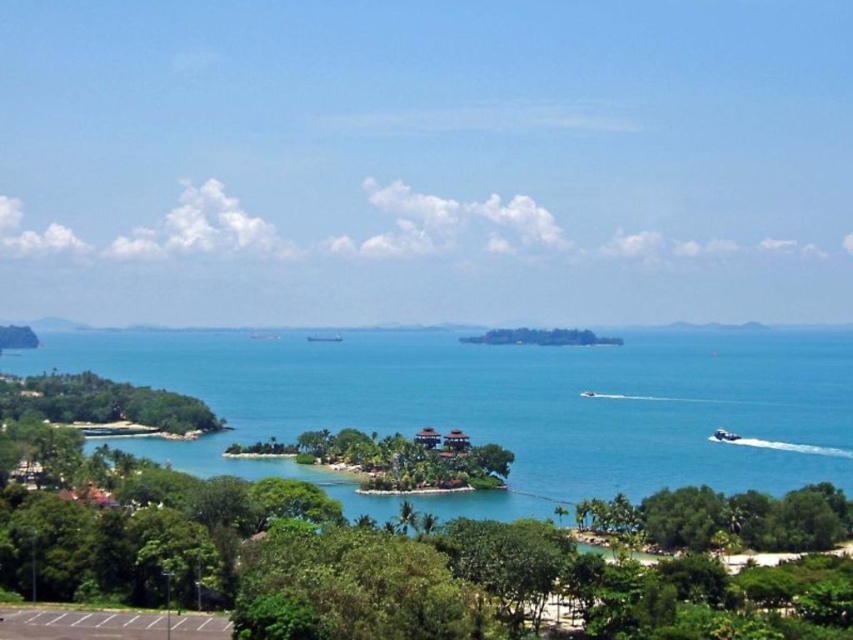
You are standing at the parking area and want to reach the island in the middle. There is a white glossy boat at lower right. Can you see the island through the blue water at center from your current position?

Yes, because the blue water at center is in front of the white glossy boat at lower right, so the island behind the water would be visible from the parking area.

You are standing at the parking area at the bottom left corner and want to walk towards the green leafy tree at center. Which direction should you head to avoid the green leafy tree at lower right?

Since the green leafy tree at lower right is to the right of the green leafy tree at center, you should head to the left to avoid the green leafy tree at lower right and reach the green leafy tree at center.

You are a photographer wanting to capture both the green leafy tree at center and the white glossy boat at lower right in a single frame. Considering their heights, which object will appear taller in your photo?

The green leafy tree at center appears taller in the photo because it has a greater height compared to the white glossy boat at lower right.